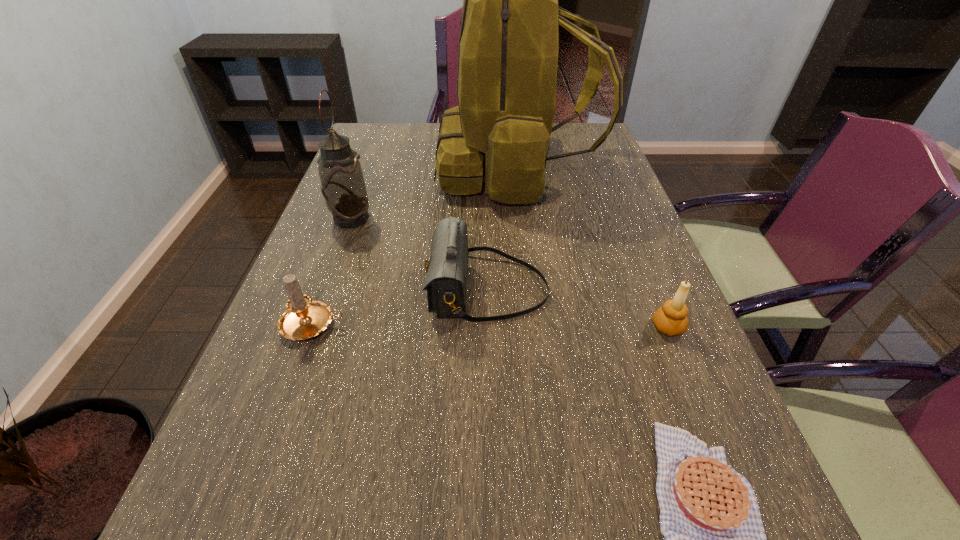
I want to click on backpack, so click(508, 48).

Image resolution: width=960 pixels, height=540 pixels. Identify the location of oil lamp. (342, 185).

This screenshot has height=540, width=960. Identify the location of shoulder bag. (447, 270).

Locate an element on the screen. The image size is (960, 540). candle is located at coordinates (303, 319).

The width and height of the screenshot is (960, 540). In order to click on candle_holder in this screenshot , I will do `click(670, 319)`.

Find the location of a particular element. Image resolution: width=960 pixels, height=540 pixels. vacant position located 0.260m on the front-facing side of the backpack is located at coordinates (357, 168).

This screenshot has width=960, height=540. I want to click on free location located on the front-facing side of the backpack, so click(403, 168).

Identify the location of free space located on the front-facing side of the backpack. The height and width of the screenshot is (540, 960). (370, 168).

What are the coordinates of `free space located 0.100m on the back of the second tallest object` in the screenshot? It's located at (363, 187).

At what (x,y) coordinates should I click in order to perform the action: click on blank space located on the left of the fourth shortest object. Please return your answer as a coordinate pair (x, y). Looking at the image, I should click on (340, 289).